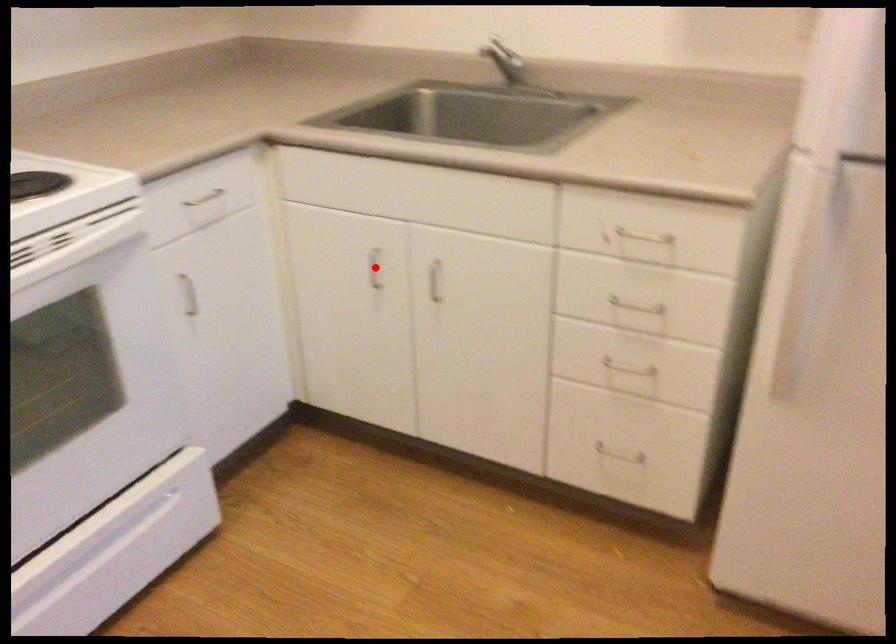
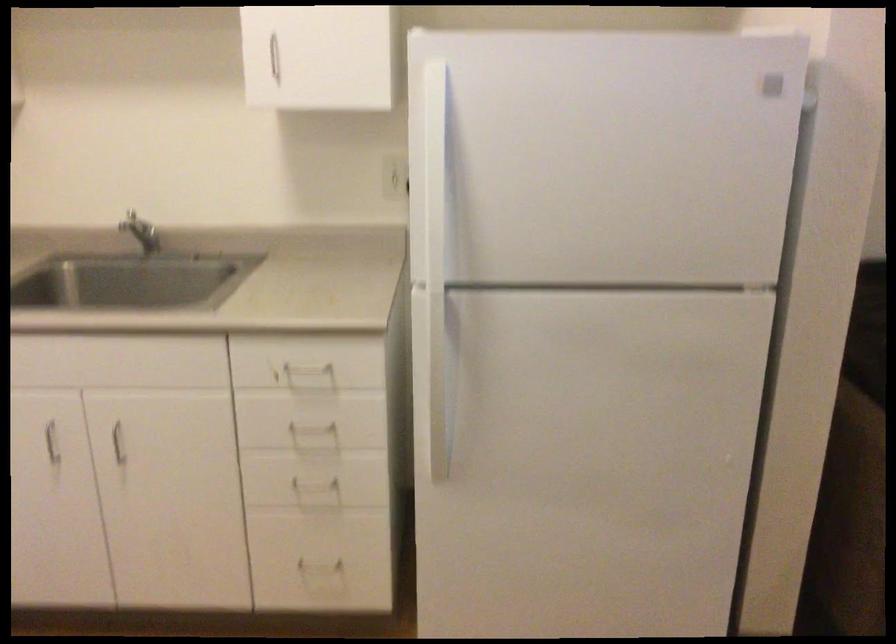
Find the pixel in the second image that matches the highlighted location in the first image.

(52, 442)